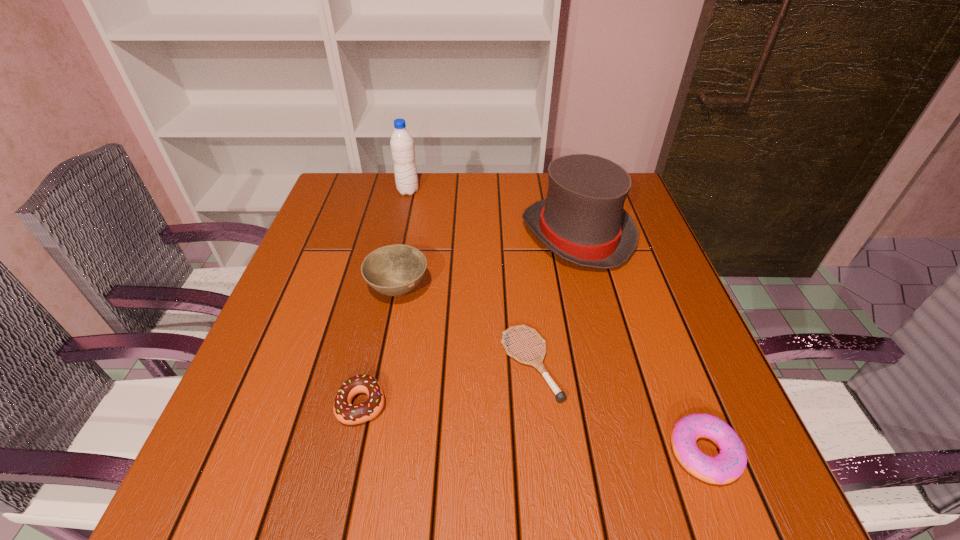
Identify the location of unoccupied area between the bowl and the left doughnut. (380, 347).

Image resolution: width=960 pixels, height=540 pixels. I want to click on empty location between the tallest object and the right doughnut, so click(557, 322).

The image size is (960, 540). I want to click on free space that is in between the tennis racket and the dress hat, so click(554, 299).

This screenshot has height=540, width=960. Identify the location of free area in between the second tallest object and the tennis racket. click(554, 299).

This screenshot has height=540, width=960. I want to click on free space between the right doughnut and the water bottle, so click(x=557, y=322).

Identify which object is the fourth closest to the shortest object. Please provide its 2D coordinates. Your answer should be formatted as a tuple, i.e. [(x, y)], where the tuple contains the x and y coordinates of a point satisfying the conditions above.

[(344, 411)]

Where is `the fifth closest object to the tennis racket`? This screenshot has height=540, width=960. the fifth closest object to the tennis racket is located at coordinates (402, 144).